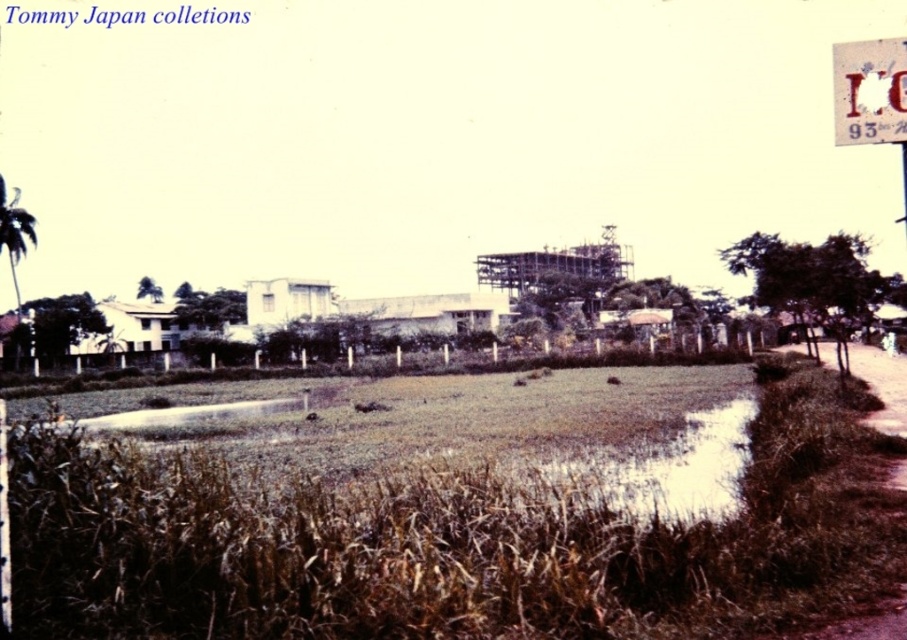
Question: Is white paper at upper right wider than brown dirt track at lower right?

Choices:
 (A) no
 (B) yes

Answer: (A)

Question: Which object appears closest to the camera in this image?

Choices:
 (A) brown dirt track at lower right
 (B) white paper at upper right

Answer: (A)

Question: Does white paper at upper right come behind brown dirt track at lower right?

Choices:
 (A) yes
 (B) no

Answer: (A)

Question: Is the position of white paper at upper right less distant than that of brown dirt track at lower right?

Choices:
 (A) yes
 (B) no

Answer: (B)

Question: Which object appears farthest from the camera in this image?

Choices:
 (A) brown dirt track at lower right
 (B) white paper at upper right

Answer: (B)

Question: Which of the following is the closest to the observer?

Choices:
 (A) (835, 76)
 (B) (896, 429)

Answer: (A)